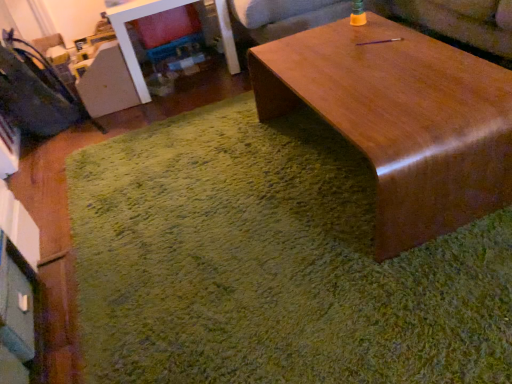
Where is `green shaggy rug at center`? This screenshot has height=384, width=512. green shaggy rug at center is located at coordinates (271, 264).

This screenshot has height=384, width=512. Find the location of `wooden couch at upper center`. wooden couch at upper center is located at coordinates (455, 24).

Is green shaggy rug at center not near glossy wood coffee table at center?

green shaggy rug at center is near glossy wood coffee table at center, not far away.

Does green shaggy rug at center have a larger size compared to glossy wood coffee table at center?

No.

Based on the photo, can you confirm if green shaggy rug at center is wider than glossy wood coffee table at center?

Yes, green shaggy rug at center is wider than glossy wood coffee table at center.

Does green shaggy rug at center lie in front of glossy wood coffee table at center?

Yes, it is in front of glossy wood coffee table at center.

Is velvet dark blue swivel chair at left placed right next to glossy wood coffee table at center?

No, velvet dark blue swivel chair at left is not beside glossy wood coffee table at center.

Considering the relative positions of velvet dark blue swivel chair at left and glossy wood coffee table at center in the image provided, is velvet dark blue swivel chair at left to the left of glossy wood coffee table at center from the viewer's perspective?

Yes, velvet dark blue swivel chair at left is to the left of glossy wood coffee table at center.

Consider the image. From their relative heights in the image, would you say velvet dark blue swivel chair at left is taller or shorter than glossy wood coffee table at center?

velvet dark blue swivel chair at left is taller than glossy wood coffee table at center.

From the picture: Measure the distance from green shaggy rug at center to velvet dark blue swivel chair at left.

green shaggy rug at center and velvet dark blue swivel chair at left are 38.83 inches apart.

You are a GUI agent. You are given a task and a screenshot of the screen. Output one action in this format:
    pyautogui.click(x=<x>, y=<y>)
    Task: Click on the swivel chair behind the green shaggy rug at center
    The height and width of the screenshot is (384, 512).
    Given the screenshot: What is the action you would take?
    pyautogui.click(x=36, y=91)

Is green shaggy rug at center far away from velvet dark blue swivel chair at left?

That's not correct — green shaggy rug at center is a little close to velvet dark blue swivel chair at left.

Is green shaggy rug at center turned away from velvet dark blue swivel chair at left?

No, green shaggy rug at center's orientation is not away from velvet dark blue swivel chair at left.

From the picture: From the image's perspective, which one is positioned higher, glossy wood coffee table at center or wooden couch at upper center?

wooden couch at upper center.

Can we say glossy wood coffee table at center lies outside wooden couch at upper center?

Indeed, glossy wood coffee table at center is completely outside wooden couch at upper center.

Is glossy wood coffee table at center taller or shorter than wooden couch at upper center?

glossy wood coffee table at center is shorter than wooden couch at upper center.

Does glossy wood coffee table at center have a smaller size compared to wooden couch at upper center?

Indeed, glossy wood coffee table at center has a smaller size compared to wooden couch at upper center.

Which is correct: velvet dark blue swivel chair at left is inside wooden couch at upper center, or outside of it?

velvet dark blue swivel chair at left is spatially situated outside wooden couch at upper center.

Considering the sizes of velvet dark blue swivel chair at left and wooden couch at upper center in the image, is velvet dark blue swivel chair at left wider or thinner than wooden couch at upper center?

Considering their sizes, velvet dark blue swivel chair at left looks slimmer than wooden couch at upper center.

From the image's perspective, relative to wooden couch at upper center, is velvet dark blue swivel chair at left above or below?

Clearly, from the image's perspective, velvet dark blue swivel chair at left is below wooden couch at upper center.

Which object is further away from the camera taking this photo, velvet dark blue swivel chair at left or wooden couch at upper center?

wooden couch at upper center.

At what (x,y) coordinates should I click in order to perform the action: click on coffee table on the right of green shaggy rug at center. Please return your answer as a coordinate pair (x, y). The height and width of the screenshot is (384, 512). Looking at the image, I should click on (401, 120).

Who is smaller, glossy wood coffee table at center or green shaggy rug at center?

green shaggy rug at center.

Does point (377, 184) come closer to viewer compared to point (246, 274)?

Yes, point (377, 184) is closer to viewer.

Between glossy wood coffee table at center and green shaggy rug at center, which one is positioned behind?

glossy wood coffee table at center is further away from the camera.

Which is in front, wooden couch at upper center or green shaggy rug at center?

green shaggy rug at center is closer to the camera.

From a real-world perspective, between wooden couch at upper center and green shaggy rug at center, who is vertically lower?

In real-world perspective, green shaggy rug at center is lower.

Is wooden couch at upper center spatially inside green shaggy rug at center, or outside of it?

wooden couch at upper center is located beyond the bounds of green shaggy rug at center.

From the image's perspective, does wooden couch at upper center appear lower than green shaggy rug at center?

Actually, wooden couch at upper center appears above green shaggy rug at center in the image.

Find the location of a particular element. The width and height of the screenshot is (512, 384). mat in front of the glossy wood coffee table at center is located at coordinates (271, 264).

Where is `swivel chair lying behind the glossy wood coffee table at center`? This screenshot has height=384, width=512. swivel chair lying behind the glossy wood coffee table at center is located at coordinates (36, 91).

Estimate the real-world distances between objects in this image. Which object is further from glossy wood coffee table at center, green shaggy rug at center or wooden couch at upper center?

Based on the image, wooden couch at upper center appears to be further to glossy wood coffee table at center.

Based on their spatial positions, is wooden couch at upper center or velvet dark blue swivel chair at left closer to green shaggy rug at center?

Based on the image, velvet dark blue swivel chair at left appears to be nearer to green shaggy rug at center.

From the image, which object appears to be farther from wooden couch at upper center, glossy wood coffee table at center or green shaggy rug at center?

Based on the image, green shaggy rug at center appears to be further to wooden couch at upper center.

Which object lies nearer to the anchor point glossy wood coffee table at center, wooden couch at upper center or velvet dark blue swivel chair at left?

Among the two, wooden couch at upper center is located nearer to glossy wood coffee table at center.

Looking at the image, which one is located further to wooden couch at upper center, green shaggy rug at center or velvet dark blue swivel chair at left?

Based on the image, velvet dark blue swivel chair at left appears to be further to wooden couch at upper center.

Considering their positions, is velvet dark blue swivel chair at left positioned closer to glossy wood coffee table at center than green shaggy rug at center?

The object closer to glossy wood coffee table at center is green shaggy rug at center.

When comparing their distances from green shaggy rug at center, does wooden couch at upper center or glossy wood coffee table at center seem closer?

glossy wood coffee table at center.

Looking at the image, which one is located further to wooden couch at upper center, green shaggy rug at center or glossy wood coffee table at center?

Among the two, green shaggy rug at center is located further to wooden couch at upper center.

Image resolution: width=512 pixels, height=384 pixels. I want to click on mat between velvet dark blue swivel chair at left and wooden couch at upper center in the horizontal direction, so click(x=271, y=264).

The height and width of the screenshot is (384, 512). What are the coordinates of `couch between velvet dark blue swivel chair at left and glossy wood coffee table at center from left to right` in the screenshot? It's located at (455, 24).

The width and height of the screenshot is (512, 384). What are the coordinates of `mat between velvet dark blue swivel chair at left and glossy wood coffee table at center` in the screenshot? It's located at (271, 264).

Find the location of `coffee table between wooden couch at upper center and green shaggy rug at center in the vertical direction`. coffee table between wooden couch at upper center and green shaggy rug at center in the vertical direction is located at coordinates (401, 120).